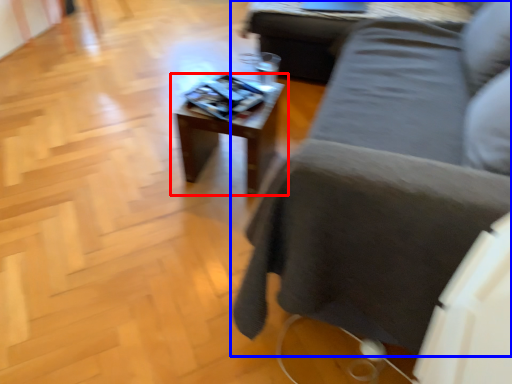
Question: Which point is further to the camera, table (highlighted by a red box) or studio couch (highlighted by a blue box)?

Choices:
 (A) table
 (B) studio couch

Answer: (A)